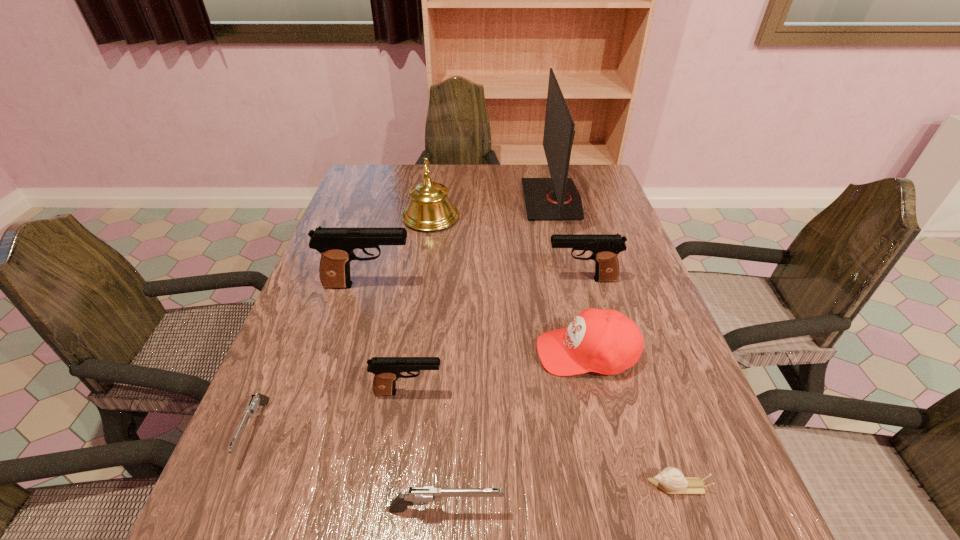
Identify the location of the nearest pistol. (421, 495).

Identify the location of the fourth farthest pistol. (253, 407).

Where is `the leftmost object`? the leftmost object is located at coordinates (253, 407).

Where is `the shortest object`? The image size is (960, 540). the shortest object is located at coordinates (671, 480).

This screenshot has height=540, width=960. In order to click on the second nearest object in this screenshot , I will do `click(671, 480)`.

Locate an element on the screen. free space located 0.230m on the screen side of the tallest object is located at coordinates (452, 200).

Identify the location of vacant space located 0.140m on the screen side of the tallest object. (480, 200).

Image resolution: width=960 pixels, height=540 pixels. I want to click on vacant space situated on the screen side of the tallest object, so click(398, 200).

Identify the location of free space located on the front of the bell. The image size is (960, 540). (425, 255).

At what (x,y) coordinates should I click in order to perform the action: click on vacant region located at the barrel of the tallest pistol. Please return your answer as a coordinate pair (x, y). Looking at the image, I should click on pyautogui.click(x=466, y=285).